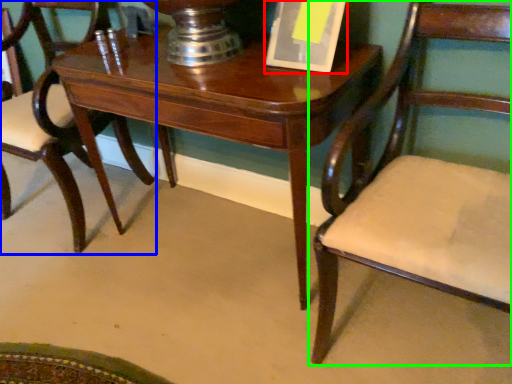
Question: Based on their relative distances, which object is nearer to paperback book (highlighted by a red box)? Choose from chair (highlighted by a blue box) and chair (highlighted by a green box).

Choices:
 (A) chair
 (B) chair

Answer: (B)